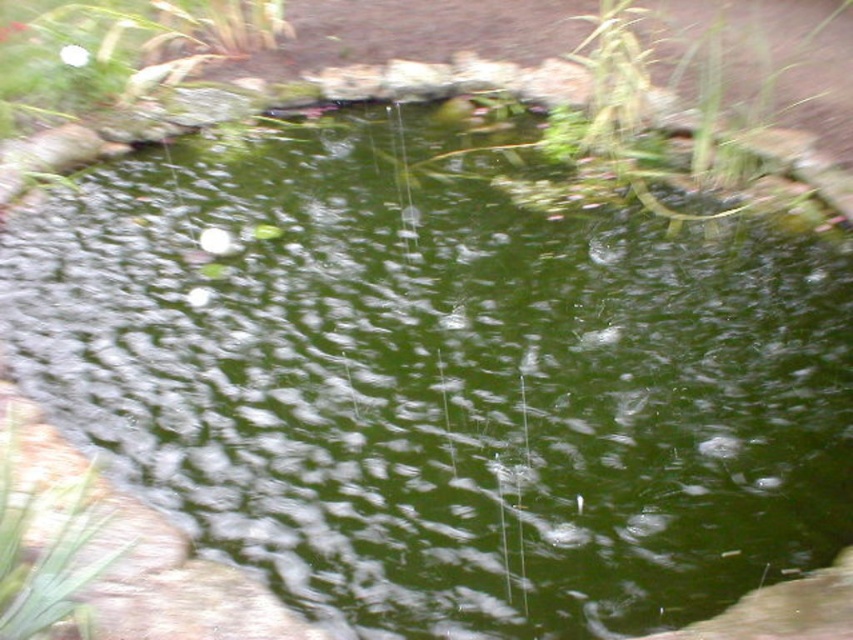
Consider the image. Is white matte rock at upper left bigger than green leafy plant at lower left?

Indeed, white matte rock at upper left has a larger size compared to green leafy plant at lower left.

Is white matte rock at upper left thinner than green leafy plant at lower left?

No, white matte rock at upper left is not thinner than green leafy plant at lower left.

Where is `white matte rock at upper left`? white matte rock at upper left is located at coordinates (111, 48).

I want to click on white matte rock at upper left, so click(x=111, y=48).

Is white matte rock at upper left bigger than green leafy plant at upper center?

Correct, white matte rock at upper left is larger in size than green leafy plant at upper center.

The width and height of the screenshot is (853, 640). In order to click on white matte rock at upper left in this screenshot , I will do `click(111, 48)`.

Identify the location of white matte rock at upper left. This screenshot has height=640, width=853. (111, 48).

Between green leafy plant at lower left and green leafy plant at upper center, which one appears on the right side from the viewer's perspective?

green leafy plant at upper center

Can you confirm if green leafy plant at lower left is wider than green leafy plant at upper center?

No, green leafy plant at lower left is not wider than green leafy plant at upper center.

Does point (90, 541) come closer to viewer compared to point (566, 72)?

Yes, point (90, 541) is in front of point (566, 72).

What are the coordinates of `green leafy plant at lower left` in the screenshot? It's located at (47, 544).